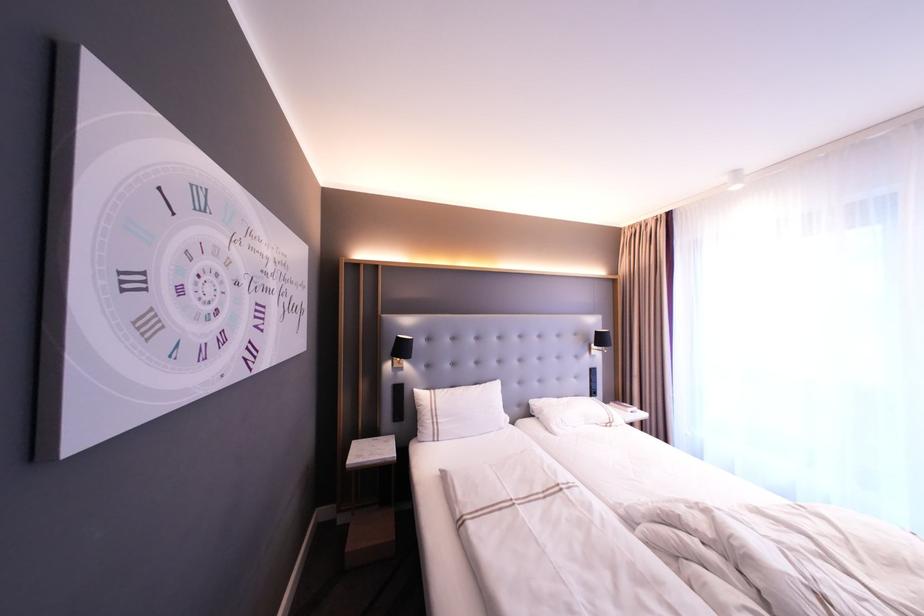
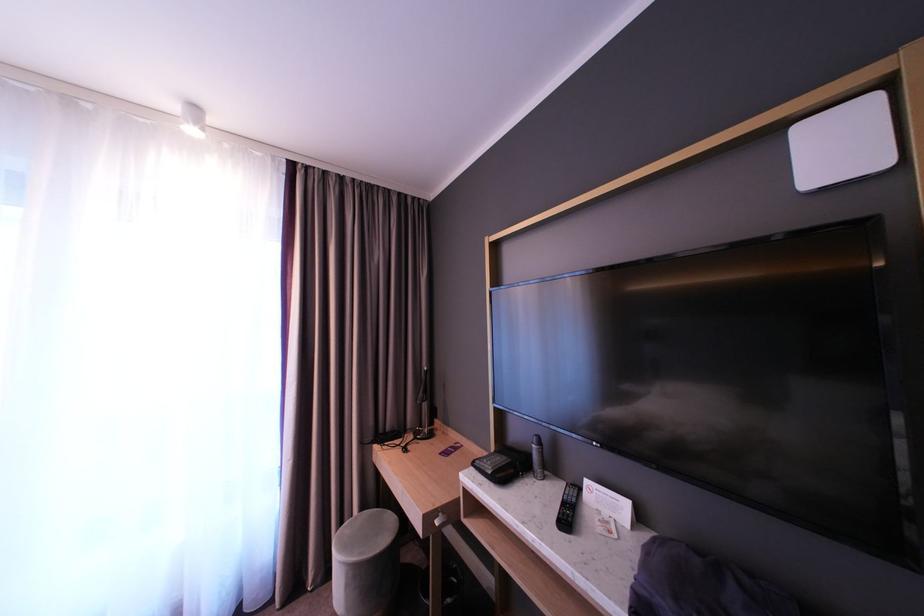
Question: The camera is either moving clockwise (left) or counter-clockwise (right) around the object. The first image is from the beginning of the video and the second image is from the end. Is the camera moving left or right when shooting the video?

Choices:
 (A) Left
 (B) Right

Answer: (A)